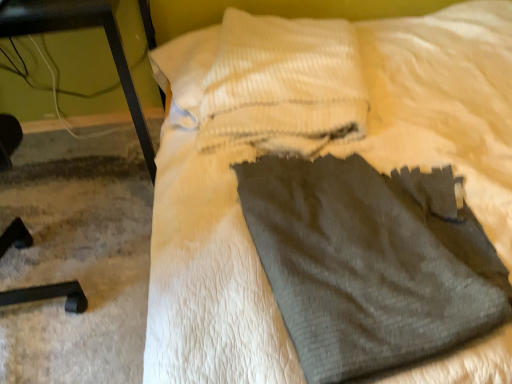
This screenshot has height=384, width=512. In order to click on gray fabric at center in this screenshot , I will do `click(307, 156)`.

What do you see at coordinates (307, 156) in the screenshot? I see `gray fabric at center` at bounding box center [307, 156].

Image resolution: width=512 pixels, height=384 pixels. Find the location of `dark gray fabric sweat pants at center`. dark gray fabric sweat pants at center is located at coordinates (370, 263).

I want to click on gray fabric at center, so click(x=307, y=156).

From the picture: Is gray fabric at center positioned beyond the bounds of white textured pillow at upper center?

Indeed, gray fabric at center is completely outside white textured pillow at upper center.

From a real-world perspective, which is physically above, gray fabric at center or white textured pillow at upper center?

white textured pillow at upper center.

Locate an element on the screen. The image size is (512, 384). pillow above the gray fabric at center (from a real-world perspective) is located at coordinates (283, 86).

Does gray fabric at center have a larger size compared to white textured pillow at upper center?

Yes.

In the image, is white textured pillow at upper center positioned in front of or behind black metal table at left?

Visually, white textured pillow at upper center is located behind black metal table at left.

Can you confirm if white textured pillow at upper center is wider than black metal table at left?

Incorrect, the width of white textured pillow at upper center does not surpass that of black metal table at left.

Looking at this image, does white textured pillow at upper center turn towards black metal table at left?

No, white textured pillow at upper center does not turn towards black metal table at left.

Between white textured pillow at upper center and black metal table at left, which one has smaller size?

white textured pillow at upper center.

Is dark gray fabric sweat pants at center to the left or to the right of black metal table at left in the image?

dark gray fabric sweat pants at center is positioned on black metal table at left's right side.

Looking at this image, which of these two, dark gray fabric sweat pants at center or black metal table at left, is bigger?

Bigger between the two is black metal table at left.

Is there a large distance between dark gray fabric sweat pants at center and black metal table at left?

No, dark gray fabric sweat pants at center is in close proximity to black metal table at left.

Based on the photo, from a real-world perspective, is dark gray fabric sweat pants at center physically located above or below black metal table at left?

In terms of real-world spatial position, dark gray fabric sweat pants at center is above black metal table at left.

From the image's perspective, which is above, dark gray fabric sweat pants at center or gray fabric at center?

gray fabric at center, from the image's perspective.

How much distance is there between dark gray fabric sweat pants at center and gray fabric at center?

dark gray fabric sweat pants at center and gray fabric at center are 28.86 centimeters apart.

In the scene shown: Is dark gray fabric sweat pants at center at the right side of gray fabric at center?

Incorrect, dark gray fabric sweat pants at center is not on the right side of gray fabric at center.

Is dark gray fabric sweat pants at center bigger than gray fabric at center?

Incorrect, dark gray fabric sweat pants at center is not larger than gray fabric at center.

Between gray fabric at center and black metal table at left, which one has less height?

With less height is gray fabric at center.

Is gray fabric at center smaller than black metal table at left?

Actually, gray fabric at center might be larger than black metal table at left.

Visually, is gray fabric at center positioned to the left or to the right of black metal table at left?

Based on their positions, gray fabric at center is located to the right of black metal table at left.

Consider the image. Can you confirm if black metal table at left is bigger than dark gray fabric sweat pants at center?

Yes, black metal table at left is bigger than dark gray fabric sweat pants at center.

Does black metal table at left come behind dark gray fabric sweat pants at center?

Yes, black metal table at left is further from the camera.

Does black metal table at left contain dark gray fabric sweat pants at center?

No, dark gray fabric sweat pants at center is located outside of black metal table at left.

In terms of height, does black metal table at left look taller or shorter compared to dark gray fabric sweat pants at center?

Clearly, black metal table at left is taller compared to dark gray fabric sweat pants at center.

Is white textured pillow at upper center at the back of black metal table at left?

No, white textured pillow at upper center is not at the back of black metal table at left.

Considering the relative sizes of black metal table at left and white textured pillow at upper center in the image provided, is black metal table at left bigger than white textured pillow at upper center?

Yes, black metal table at left is bigger than white textured pillow at upper center.

Considering the relative positions of black metal table at left and white textured pillow at upper center in the image provided, is black metal table at left behind white textured pillow at upper center?

No, it is not.

Which point is more distant from viewer, (x=22, y=27) or (x=334, y=29)?

The point (x=334, y=29) is more distant.

The image size is (512, 384). In order to click on bed in front of the white textured pillow at upper center in this screenshot , I will do `click(307, 156)`.

Locate an element on the screen. The height and width of the screenshot is (384, 512). furniture that appears on the left of white textured pillow at upper center is located at coordinates (76, 29).

When comparing their distances from gray fabric at center, does white textured pillow at upper center or black metal table at left seem closer?

The object closer to gray fabric at center is white textured pillow at upper center.

Which object lies further to the anchor point white textured pillow at upper center, gray fabric at center or black metal table at left?

black metal table at left is positioned further to the anchor white textured pillow at upper center.

Considering their positions, is gray fabric at center positioned closer to black metal table at left than dark gray fabric sweat pants at center?

gray fabric at center is positioned closer to the anchor black metal table at left.

Which object lies further to the anchor point gray fabric at center, black metal table at left or white textured pillow at upper center?

black metal table at left is further to gray fabric at center.

Estimate the real-world distances between objects in this image. Which object is further from gray fabric at center, dark gray fabric sweat pants at center or black metal table at left?

black metal table at left.

Looking at the image, which one is located closer to dark gray fabric sweat pants at center, white textured pillow at upper center or black metal table at left?

The object closer to dark gray fabric sweat pants at center is white textured pillow at upper center.

Estimate the real-world distances between objects in this image. Which object is closer to white textured pillow at upper center, gray fabric at center or dark gray fabric sweat pants at center?

The object closer to white textured pillow at upper center is gray fabric at center.

Which object lies nearer to the anchor point dark gray fabric sweat pants at center, black metal table at left or gray fabric at center?

gray fabric at center is closer to dark gray fabric sweat pants at center.

Where is `pillow between black metal table at left and dark gray fabric sweat pants at center from left to right`? This screenshot has height=384, width=512. pillow between black metal table at left and dark gray fabric sweat pants at center from left to right is located at coordinates (283, 86).

I want to click on sweat pant positioned between gray fabric at center and white textured pillow at upper center from near to far, so click(370, 263).

Locate an element on the screen. sweat pant located between black metal table at left and gray fabric at center in the left-right direction is located at coordinates (370, 263).

I want to click on pillow between black metal table at left and gray fabric at center, so click(283, 86).